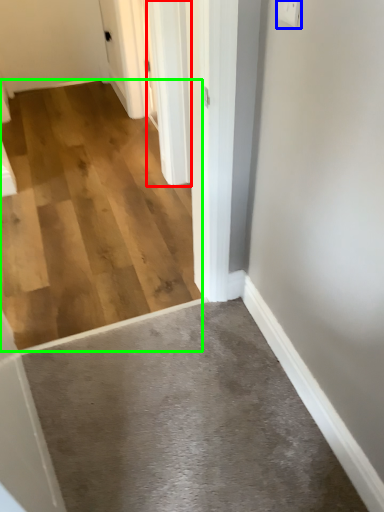
Question: Considering the real-world distances, which object is farthest from door (highlighted by a red box)? electric outlet (highlighted by a blue box) or concrete (highlighted by a green box)?

Choices:
 (A) electric outlet
 (B) concrete

Answer: (A)